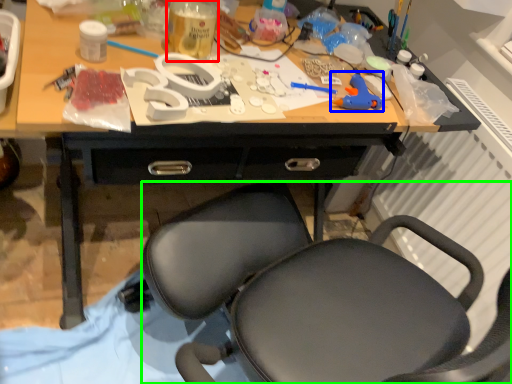
Question: Based on their relative distances, which object is farther from bottle (highlighted by a red box)? Choose from toy (highlighted by a blue box) and chair (highlighted by a green box).

Choices:
 (A) toy
 (B) chair

Answer: (B)